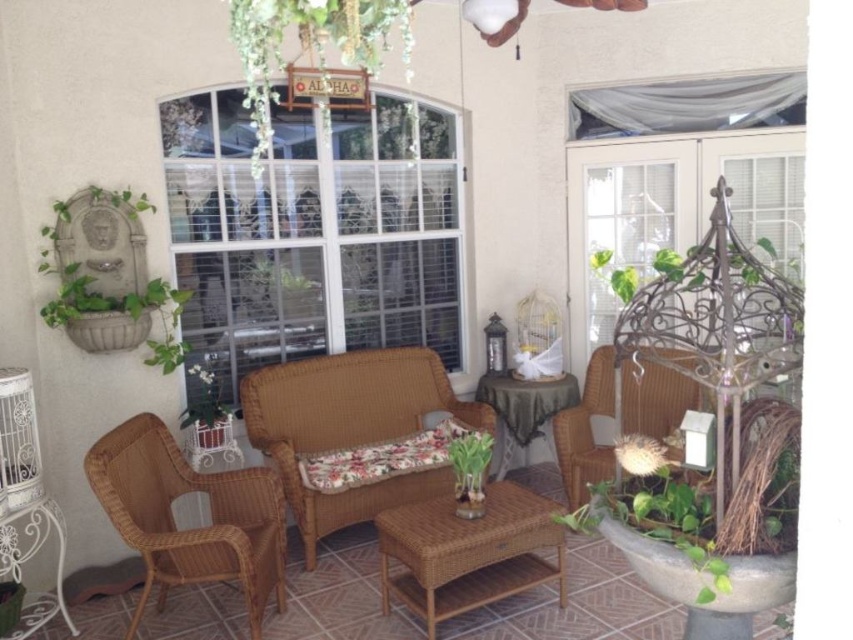
Question: Does woven rattan armchair at left come in front of green glossy vase at center?

Choices:
 (A) no
 (B) yes

Answer: (B)

Question: Which of these objects is positioned farthest from the green stone fountain at left?

Choices:
 (A) green fabric-covered table at center
 (B) rattan wicker coffee table at center
 (C) green leafy plant at lower right
 (D) woven rattan armchair at center

Answer: (C)

Question: Among these objects, which one is nearest to the camera?

Choices:
 (A) woven rattan armchair at center
 (B) rattan wicker coffee table at center
 (C) green wicker basket at lower left

Answer: (B)

Question: Does green fabric-covered table at center appear under green glossy vase at center?

Choices:
 (A) yes
 (B) no

Answer: (A)

Question: Observing the image, what is the correct spatial positioning of woven rattan armchair at center in reference to green leafy plant at upper center?

Choices:
 (A) left
 (B) right

Answer: (A)

Question: Which point is closer to the camera?

Choices:
 (A) green leafy plant at upper center
 (B) green wicker basket at lower left
 (C) woven rattan armchair at center

Answer: (A)